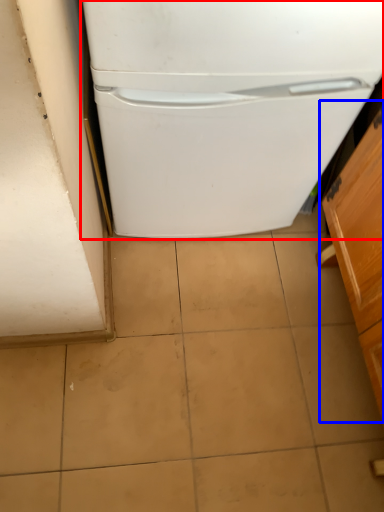
Question: Among these objects, which one is farthest to the camera, refrigerator (highlighted by a red box) or cabinetry (highlighted by a blue box)?

Choices:
 (A) refrigerator
 (B) cabinetry

Answer: (A)